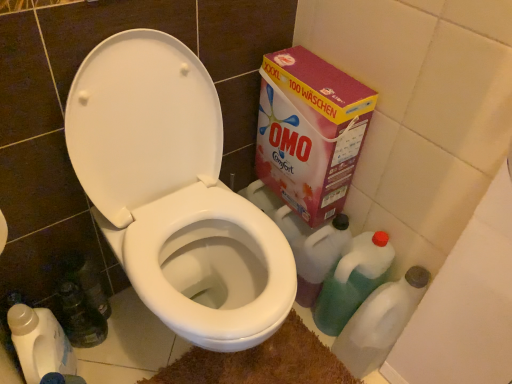
Question: In terms of height, does pink cardboard box at upper right look taller or shorter compared to brown shaggy bath mat at lower center?

Choices:
 (A) short
 (B) tall

Answer: (B)

Question: From the image's perspective, is pink cardboard box at upper right positioned above or below brown shaggy bath mat at lower center?

Choices:
 (A) below
 (B) above

Answer: (B)

Question: Estimate the real-world distances between objects in this image. Which object is farther from the white glossy toilet at center?

Choices:
 (A) translucent plastic bottle at lower right
 (B) brown shaggy bath mat at lower center
 (C) translucent plastic bottle at lower right, which is the first cleaning product from right to left
 (D) white plastic bottle at lower left, which is counted as the second cleaning product, starting from the right
 (E) pink cardboard box at upper right

Answer: (A)

Question: Which object is the farthest from the translucent plastic bottle at lower right?

Choices:
 (A) translucent plastic bottle at lower right, which is the first cleaning product from right to left
 (B) brown shaggy bath mat at lower center
 (C) white plastic bottle at lower left, which is counted as the second cleaning product, starting from the right
 (D) white glossy toilet at center
 (E) pink cardboard box at upper right

Answer: (C)